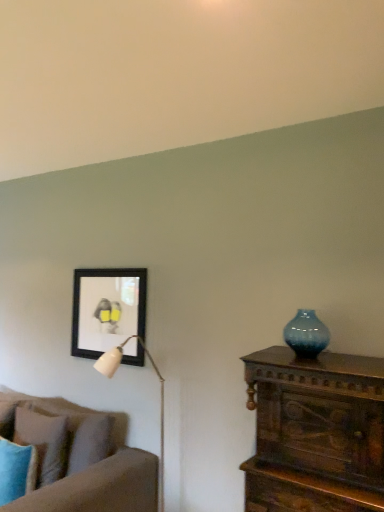
Question: Can you confirm if blue glass vase at right is positioned to the right of matte blue pillow at lower left, marked as the second pillow in a back-to-front arrangement?

Choices:
 (A) no
 (B) yes

Answer: (B)

Question: Can you confirm if blue glass vase at right is bigger than matte blue pillow at lower left, marked as the second pillow in a back-to-front arrangement?

Choices:
 (A) yes
 (B) no

Answer: (B)

Question: Is blue glass vase at right outside of matte blue pillow at lower left, marked as the second pillow in a back-to-front arrangement?

Choices:
 (A) yes
 (B) no

Answer: (A)

Question: Does blue glass vase at right appear on the left side of matte blue pillow at lower left, marked as the second pillow in a back-to-front arrangement?

Choices:
 (A) yes
 (B) no

Answer: (B)

Question: Is blue glass vase at right directly adjacent to matte blue pillow at lower left, marked as the second pillow in a back-to-front arrangement?

Choices:
 (A) yes
 (B) no

Answer: (B)

Question: From the image's perspective, is blue glass vase at right beneath matte blue pillow at lower left, which is the 1th pillow from front to back?

Choices:
 (A) no
 (B) yes

Answer: (A)

Question: Is matte blue pillow at lower left, which is the 1th pillow from front to back, beside black matte picture frame at upper left?

Choices:
 (A) no
 (B) yes

Answer: (A)

Question: Does matte blue pillow at lower left, which is the 1th pillow from front to back, have a greater width compared to black matte picture frame at upper left?

Choices:
 (A) no
 (B) yes

Answer: (B)

Question: Is matte blue pillow at lower left, marked as the second pillow in a back-to-front arrangement, facing away from black matte picture frame at upper left?

Choices:
 (A) yes
 (B) no

Answer: (B)

Question: Is black matte picture frame at upper left inside matte blue pillow at lower left, marked as the second pillow in a back-to-front arrangement?

Choices:
 (A) no
 (B) yes

Answer: (A)

Question: From a real-world perspective, is matte blue pillow at lower left, marked as the second pillow in a back-to-front arrangement, on black matte picture frame at upper left?

Choices:
 (A) no
 (B) yes

Answer: (A)

Question: Is matte blue pillow at lower left, marked as the second pillow in a back-to-front arrangement, to the right of black matte picture frame at upper left from the viewer's perspective?

Choices:
 (A) no
 (B) yes

Answer: (A)

Question: From a real-world perspective, is matte blue pillow at lower left, marked as the second pillow in a back-to-front arrangement, over soft brown fabric couch at left?

Choices:
 (A) no
 (B) yes

Answer: (B)